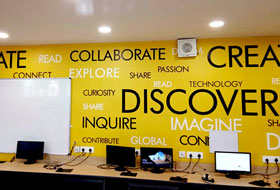
The width and height of the screenshot is (280, 190). I want to click on white ceiling, so click(x=163, y=23).